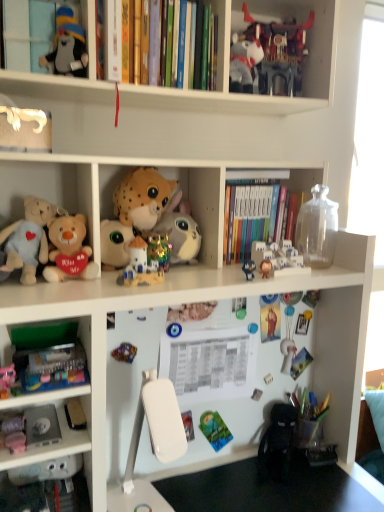
Question: From the image's perspective, is metallic multicolored toy at center, the 7th toy when ordered from top to bottom, positioned above or below matte black plush toy at upper left, acting as the second toy starting from the top?

Choices:
 (A) below
 (B) above

Answer: (A)

Question: Is metallic multicolored toy at center, the 7th toy when ordered from top to bottom, taller or shorter than matte black plush toy at upper left, arranged as the eighth toy when ordered from the bottom?

Choices:
 (A) tall
 (B) short

Answer: (B)

Question: Based on their relative distances, which object is farther from the shiny plastic robot at upper center, the ninth toy positioned from the bottom?

Choices:
 (A) white plastic table at lower center
 (B) soft plush toys at left, acting as the second shelf starting from the top
 (C) matte plush toy at upper left, positioned as the second cabinet in bottom-to-top order
 (D) metallic multicolored toy at center, which ranks as the third toy in bottom-to-top order
 (E) shiny plastic castle at center, the sixth toy when ordered from top to bottom

Answer: (A)

Question: Which is nearer to the metallic multicolored toy at center, the 7th toy when ordered from top to bottom?

Choices:
 (A) hardcover books at center, marked as the second book in a front-to-back arrangement
 (B) fluffy beige bear at left, which ranks as the 4th toy in top-to-bottom order
 (C) white plastic table at lower center
 (D) shiny plastic castle at center, arranged as the fourth toy when ordered from the bottom
 (E) white plastic castle at upper center, marked as the fifth toy in a bottom-to-top arrangement

Answer: (D)